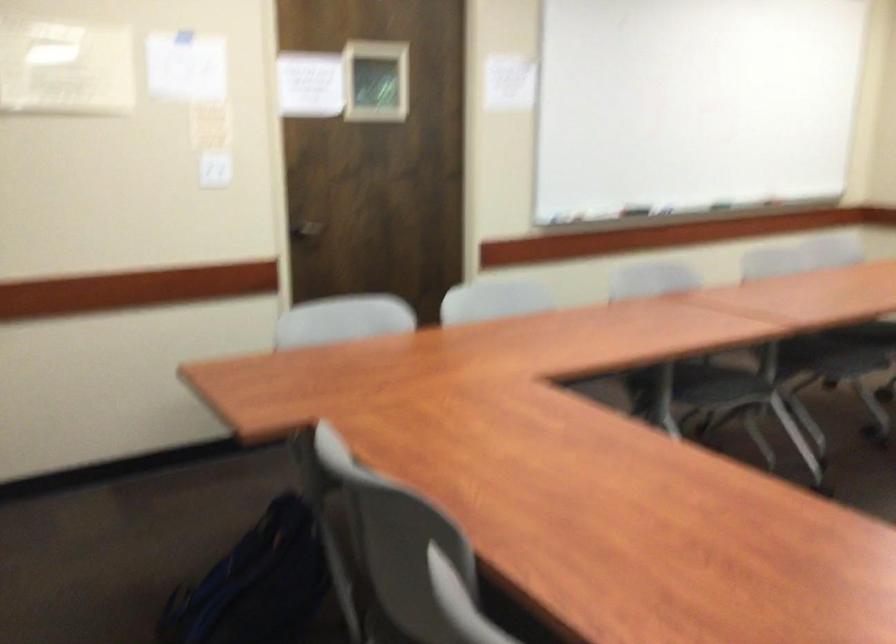
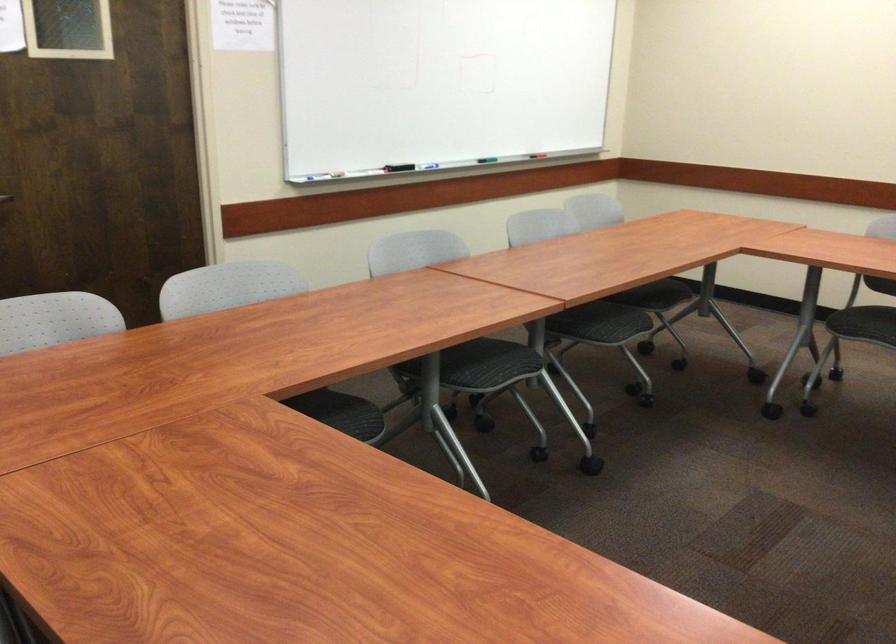
Locate, in the second image, the point that corresponds to (x=686, y=128) in the first image.

(438, 82)